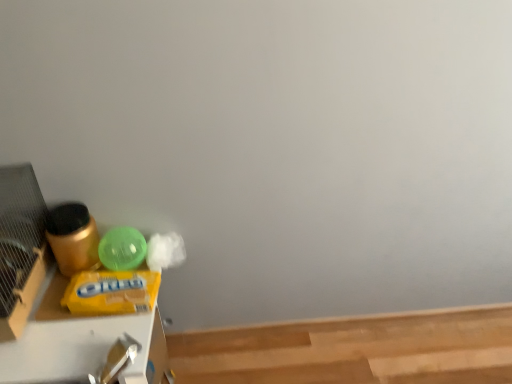
Question: Looking at their shapes, would you say light brown smooth wood at lower right is wider or thinner than yellow matte plastic wipes at left?

Choices:
 (A) thin
 (B) wide

Answer: (B)

Question: In terms of size, does light brown smooth wood at lower right appear bigger or smaller than yellow matte plastic wipes at left?

Choices:
 (A) small
 (B) big

Answer: (A)

Question: Is light brown smooth wood at lower right in front of or behind yellow matte plastic wipes at left in the image?

Choices:
 (A) front
 (B) behind

Answer: (B)

Question: Considering the positions of yellow matte plastic wipes at left and light brown smooth wood at lower right in the image, is yellow matte plastic wipes at left taller or shorter than light brown smooth wood at lower right?

Choices:
 (A) tall
 (B) short

Answer: (A)

Question: From the image's perspective, relative to light brown smooth wood at lower right, is yellow matte plastic wipes at left above or below?

Choices:
 (A) below
 (B) above

Answer: (B)

Question: Visually, is yellow matte plastic wipes at left positioned to the left or to the right of light brown smooth wood at lower right?

Choices:
 (A) right
 (B) left

Answer: (B)

Question: Does point (96, 360) appear closer or farther from the camera than point (440, 357)?

Choices:
 (A) closer
 (B) farther

Answer: (A)